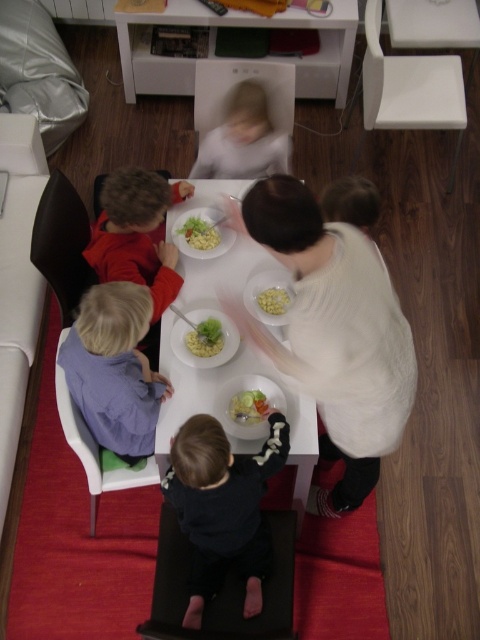
Is white matte shirt at upper center to the left of translucent plastic bowl at center from the viewer's perspective?

In fact, white matte shirt at upper center is to the right of translucent plastic bowl at center.

Locate an element on the screen. Image resolution: width=480 pixels, height=640 pixels. white matte shirt at upper center is located at coordinates (334, 333).

This screenshot has width=480, height=640. What do you see at coordinates (334, 333) in the screenshot?
I see `white matte shirt at upper center` at bounding box center [334, 333].

The width and height of the screenshot is (480, 640). In order to click on white matte shirt at upper center in this screenshot , I will do `click(334, 333)`.

Is point (97, 380) farther from viewer compared to point (203, 257)?

No, it is in front of (203, 257).

Who is more forward, (x=60, y=349) or (x=211, y=221)?

Point (x=60, y=349)

The image size is (480, 640). Find the location of `purple fabric shirt at lower left`. purple fabric shirt at lower left is located at coordinates (115, 369).

Does green matte salad bowl at center appear on the right side of yellow matte pasta bowl at center?

Correct, you'll find green matte salad bowl at center to the right of yellow matte pasta bowl at center.

Who is positioned more to the right, green matte salad bowl at center or yellow matte pasta bowl at center?

green matte salad bowl at center is more to the right.

What do you see at coordinates (191, 330) in the screenshot? I see `green matte salad bowl at center` at bounding box center [191, 330].

Identify the location of green matte salad bowl at center. This screenshot has width=480, height=640. (191, 330).